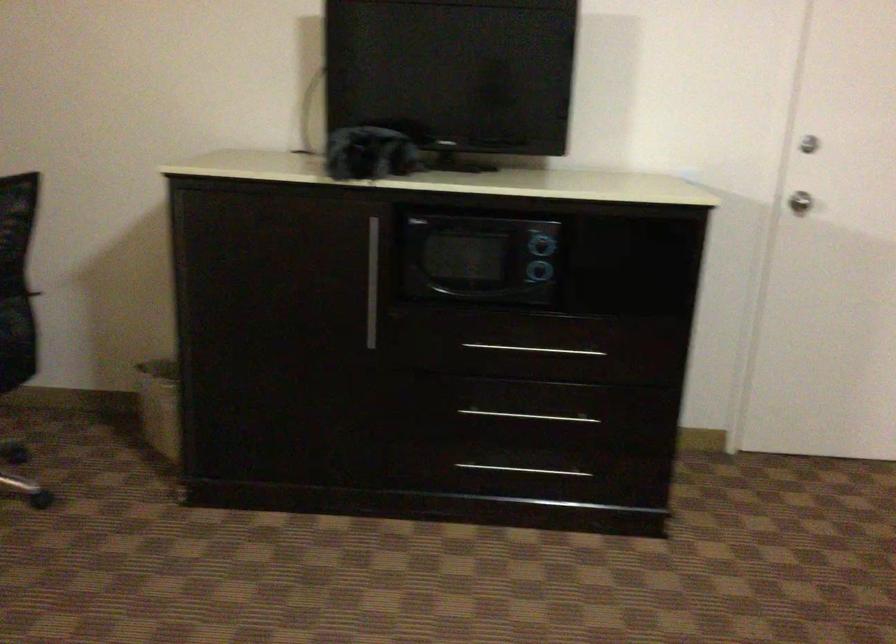
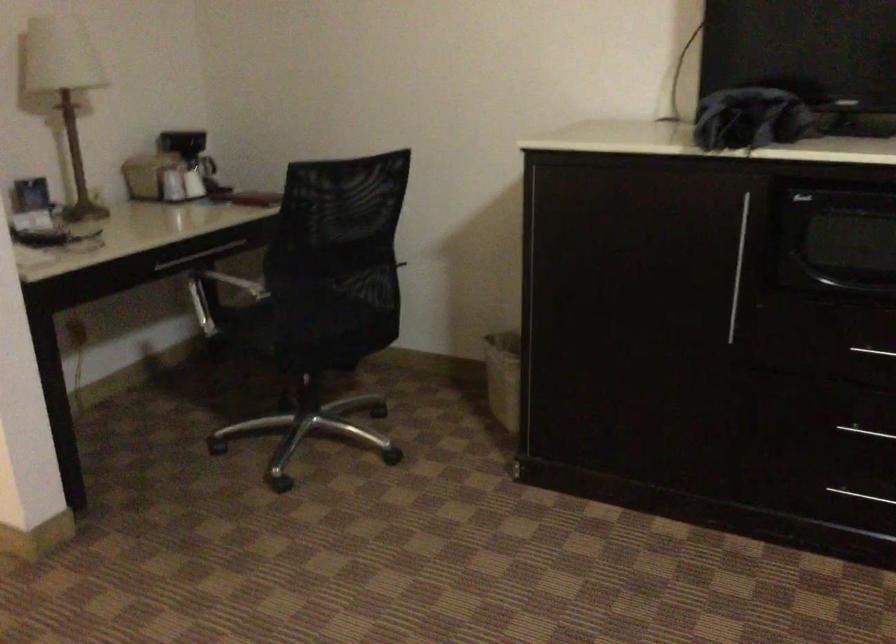
Question: Which direction would the cameraman need to move to produce the second image? Reply with the corresponding letter.

Choices:
 (A) Left
 (B) Right
 (C) Forward
 (D) Backward

Answer: (C)